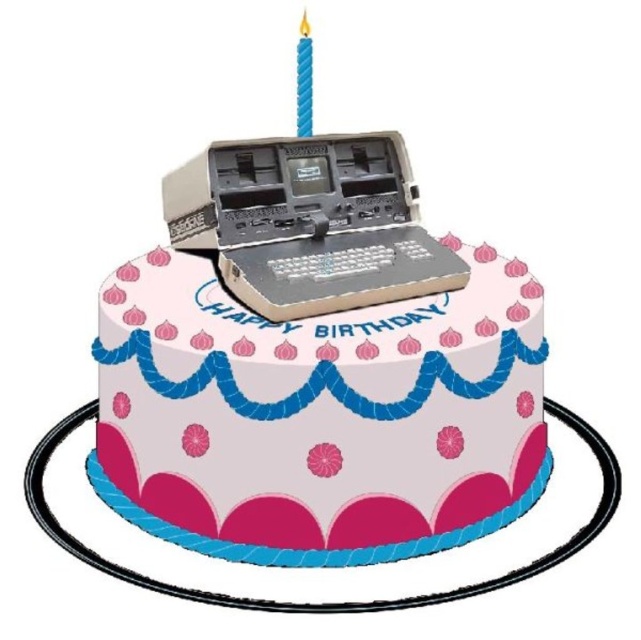
Does beige plastic register at center have a smaller size compared to blue wax candle at upper center?

No.

Is beige plastic register at center to the left of blue wax candle at upper center from the viewer's perspective?

No, beige plastic register at center is not to the left of blue wax candle at upper center.

Which is behind, point (162, 198) or point (310, 84)?

The point (162, 198) is more distant.

Locate an element on the screen. beige plastic register at center is located at coordinates (310, 221).

Who is positioned more to the right, white matte cake at center or beige plastic register at center?

From the viewer's perspective, beige plastic register at center appears more on the right side.

Measure the distance from white matte cake at center to beige plastic register at center.

2.95 inches

Where is `white matte cake at center`? This screenshot has width=641, height=640. white matte cake at center is located at coordinates (319, 416).

Does point (194, 513) come in front of point (312, 125)?

That is True.

Can you confirm if white matte cake at center is wider than blue wax candle at upper center?

Correct, the width of white matte cake at center exceeds that of blue wax candle at upper center.

Locate an element on the screen. white matte cake at center is located at coordinates pyautogui.click(x=319, y=416).